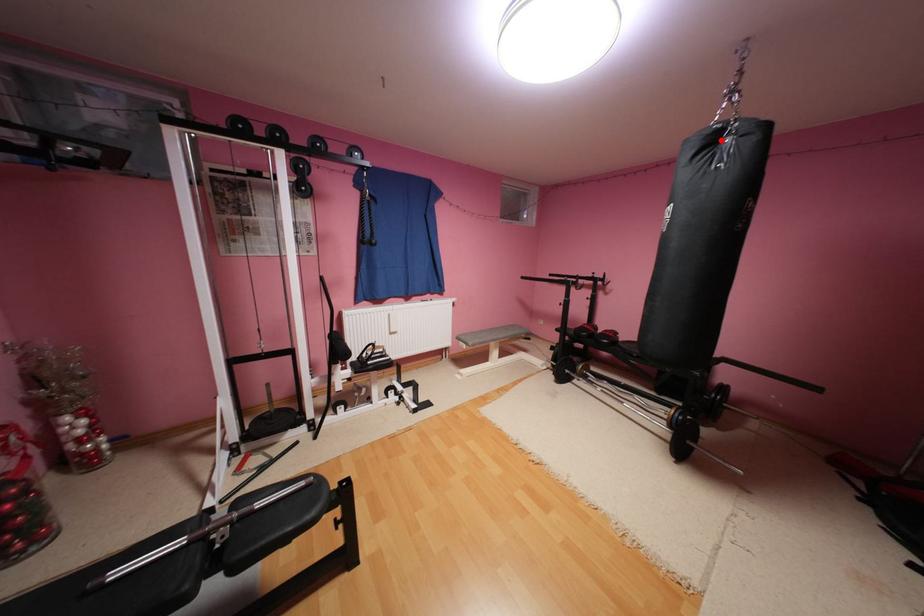
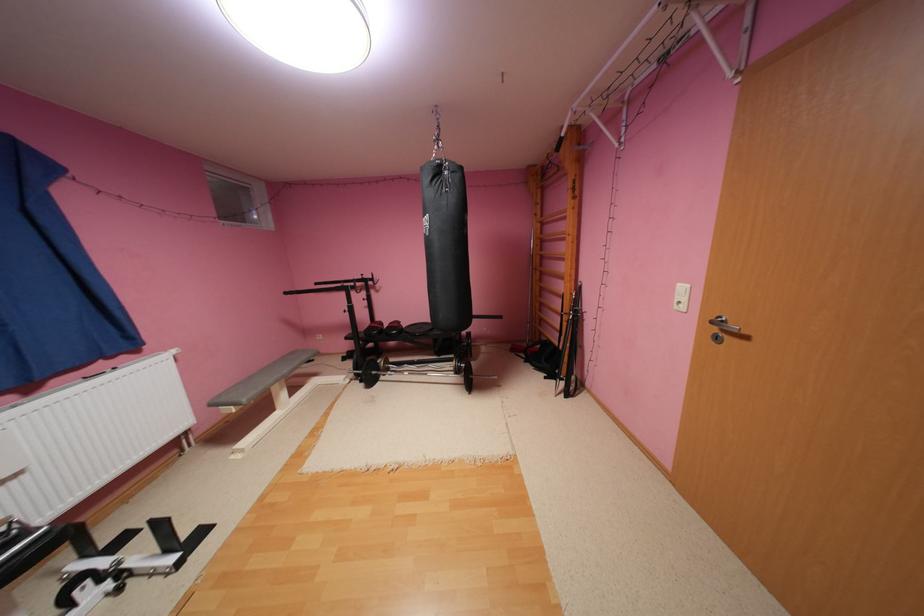
Locate, in the second image, the point that corresponds to the highlighted location in the first image.

(446, 171)